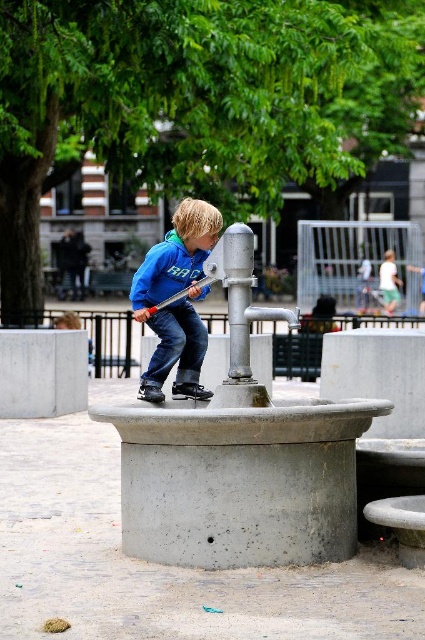
Is point (274, 556) farther from camera compared to point (382, 289)?

That is False.

Who is more forward, (x=144, y=493) or (x=387, y=250)?

Positioned in front is point (x=144, y=493).

This screenshot has height=640, width=425. What do you see at coordinates (240, 481) in the screenshot?
I see `concreteroughfountain at center` at bounding box center [240, 481].

Image resolution: width=425 pixels, height=640 pixels. Find the location of `concreteroughfountain at center`. concreteroughfountain at center is located at coordinates (240, 481).

Is gray concrete at lower left to the left of jeans at center from the viewer's perspective?

Yes, gray concrete at lower left is to the left of jeans at center.

Where is `gray concrete at lower left`? The height and width of the screenshot is (640, 425). gray concrete at lower left is located at coordinates (42, 372).

This screenshot has width=425, height=640. I want to click on gray concrete at lower left, so click(x=42, y=372).

Does blue fleece jacket at center have a lesser width compared to gray concrete at center?

Yes, blue fleece jacket at center is thinner than gray concrete at center.

The image size is (425, 640). Find the location of `blue fleece jacket at center`. blue fleece jacket at center is located at coordinates (176, 300).

Identify the location of blue fleece jacket at center. The height and width of the screenshot is (640, 425). (176, 300).

Find the location of a particular element. This screenshot has width=425, height=640. blue fleece jacket at center is located at coordinates (176, 300).